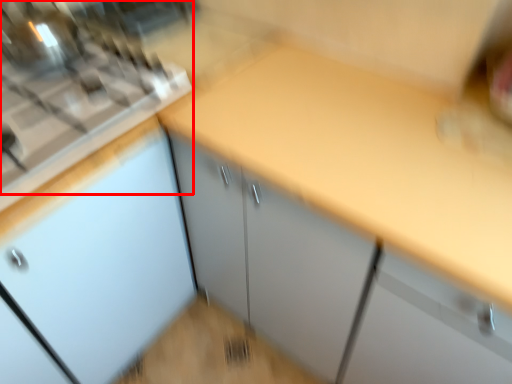
Question: From the image's perspective, where is gas stove (annotated by the red box) located relative to countertop?

Choices:
 (A) above
 (B) below

Answer: (A)